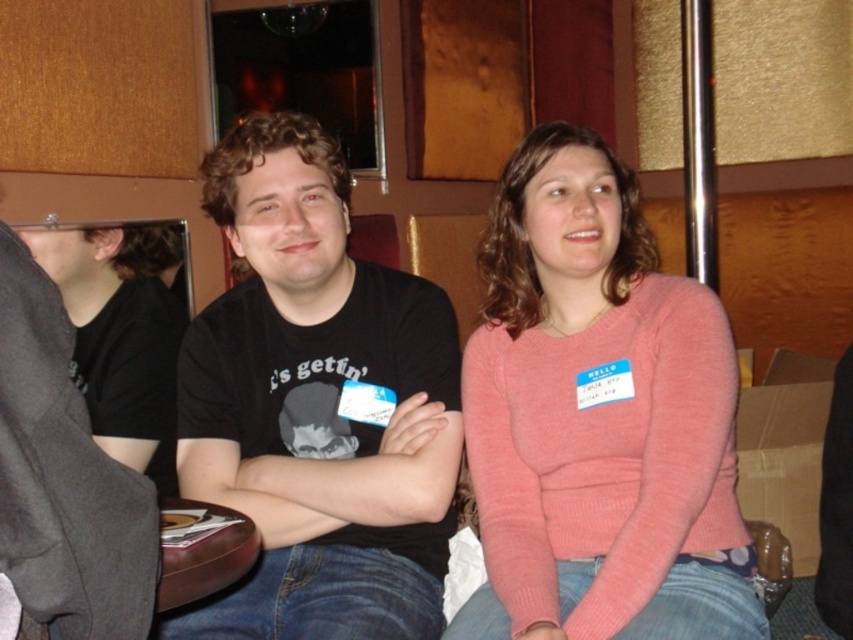
Can you confirm if pink knitted sweater at center is positioned to the right of black matte shirt at left?

Correct, you'll find pink knitted sweater at center to the right of black matte shirt at left.

Is pink knitted sweater at center taller than black matte shirt at left?

Indeed, pink knitted sweater at center has a greater height compared to black matte shirt at left.

Between point (527, 141) and point (88, 340), which one is positioned behind?

Point (88, 340)

Locate an element on the screen. pink knitted sweater at center is located at coordinates (598, 419).

Does black matte t-shirt at center have a smaller size compared to black matte shirt at left?

Actually, black matte t-shirt at center might be larger than black matte shirt at left.

Is point (196, 346) less distant than point (119, 285)?

Yes.

You are a GUI agent. You are given a task and a screenshot of the screen. Output one action in this format:
    pyautogui.click(x=<x>, y=<y>)
    Task: Click on the black matte t-shirt at center
    This screenshot has width=853, height=640.
    Given the screenshot: What is the action you would take?
    pyautogui.click(x=316, y=404)

Locate an element on the screen. The height and width of the screenshot is (640, 853). black matte t-shirt at center is located at coordinates (316, 404).

You are a GUI agent. You are given a task and a screenshot of the screen. Output one action in this format:
    pyautogui.click(x=<x>, y=<y>)
    Task: Click on the pink knitted sweater at center
    The image size is (853, 640).
    Given the screenshot: What is the action you would take?
    pyautogui.click(x=598, y=419)

Between point (595, 212) and point (386, 378), which one is positioned behind?

The point (386, 378) is more distant.

Find the location of a particular element. pink knitted sweater at center is located at coordinates (598, 419).